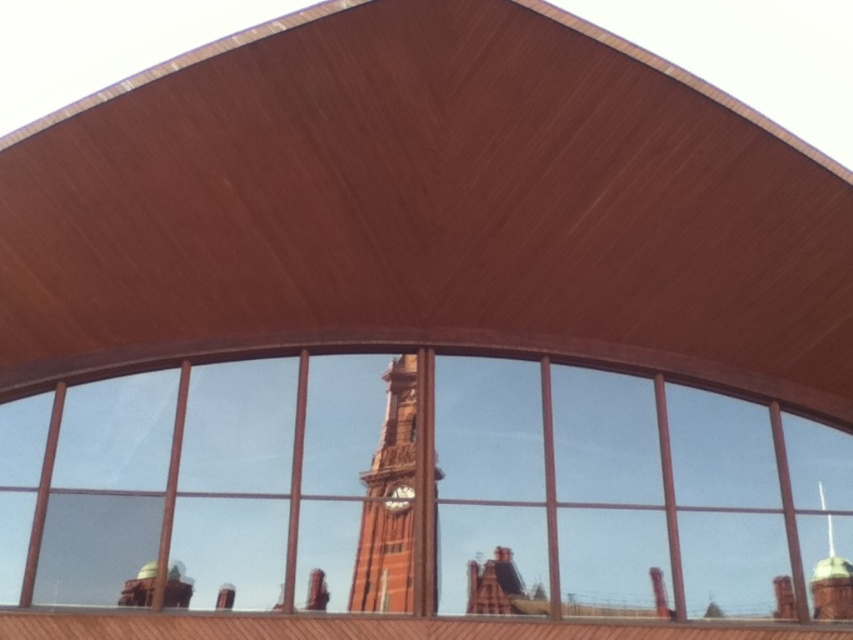
Is clear glass window at center positioned behind red brick clock tower at center?

No.

Is clear glass window at center shorter than red brick clock tower at center?

Incorrect, clear glass window at center's height does not fall short of red brick clock tower at center's.

Looking at this image, measure the distance between point [567,474] and camera.

Point [567,474] and camera are 10.20 meters apart from each other.

You are a GUI agent. You are given a task and a screenshot of the screen. Output one action in this format:
    pyautogui.click(x=<x>, y=<y>)
    Task: Click on the clear glass window at center
    The height and width of the screenshot is (640, 853).
    Given the screenshot: What is the action you would take?
    pyautogui.click(x=421, y=486)

Can you confirm if red brick clock tower at center is positioned below matte brown clock at center?

No, red brick clock tower at center is not below matte brown clock at center.

Who is higher up, red brick clock tower at center or matte brown clock at center?

red brick clock tower at center is higher up.

Which is in front, point (375, 557) or point (410, 493)?

Point (375, 557) is more forward.

The width and height of the screenshot is (853, 640). Find the location of `red brick clock tower at center`. red brick clock tower at center is located at coordinates (386, 499).

Who is taller, clear glass window at center or matte brown clock at center?

With more height is clear glass window at center.

Can you confirm if clear glass window at center is taller than matte brown clock at center?

Yes, clear glass window at center is taller than matte brown clock at center.

The image size is (853, 640). What do you see at coordinates (421, 486) in the screenshot?
I see `clear glass window at center` at bounding box center [421, 486].

Find the location of a particular element. This screenshot has height=640, width=853. clear glass window at center is located at coordinates (421, 486).